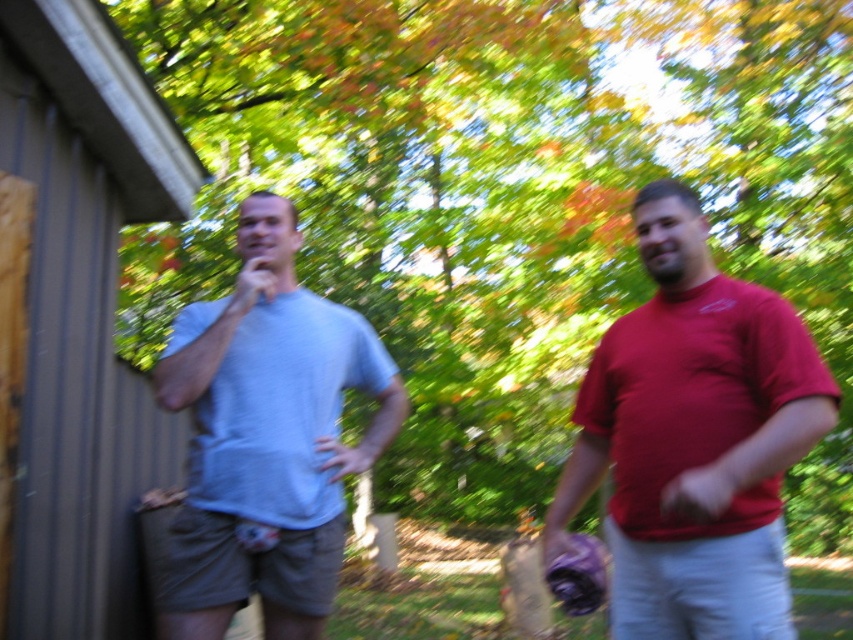
You are standing in the park and see two points in the image. Which point, point (669,445) or point (566,552), is nearer to you?

Point (669,445) is closer to the viewer than point (566,552).